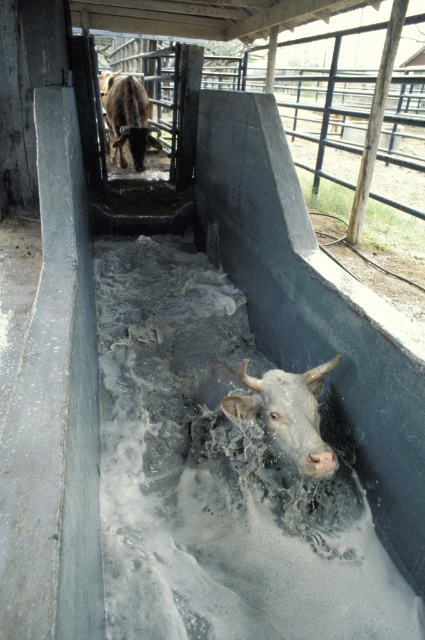
Question: Which of the following is the closest to the observer?

Choices:
 (A) gray matte cow at center
 (B) brown glossy bull at upper center

Answer: (A)

Question: Which object appears farthest from the camera in this image?

Choices:
 (A) brown glossy bull at upper center
 (B) gray matte cow at center

Answer: (A)

Question: Is gray matte cow at center above brown glossy bull at upper center?

Choices:
 (A) yes
 (B) no

Answer: (B)

Question: Is gray matte cow at center further to the viewer compared to brown glossy bull at upper center?

Choices:
 (A) no
 (B) yes

Answer: (A)

Question: Is gray matte cow at center wider than brown glossy bull at upper center?

Choices:
 (A) yes
 (B) no

Answer: (B)